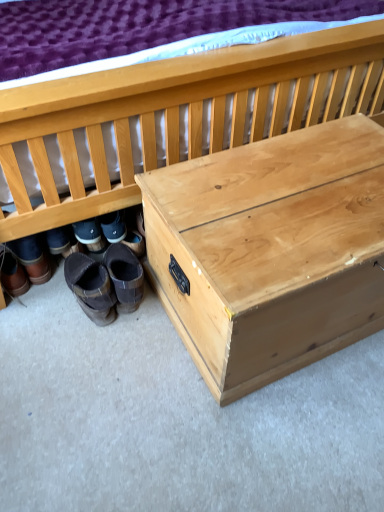
Question: Considering the positions of natural wood trunk at center and natural wood chest at lower right in the image, is natural wood trunk at center taller or shorter than natural wood chest at lower right?

Choices:
 (A) tall
 (B) short

Answer: (B)

Question: From the image's perspective, is natural wood trunk at center above or below natural wood chest at lower right?

Choices:
 (A) below
 (B) above

Answer: (A)

Question: Estimate the real-world distances between objects in this image. Which object is farther from the brown leather boots at lower left, acting as the 2th footwear starting from the left?

Choices:
 (A) brown suede boots at lower left, acting as the 4th footwear starting from the left
 (B) brown leather boots at lower left, the 4th footwear from the right
 (C) natural wood trunk at center
 (D) brown suede boots at lower left, which is counted as the third footwear, starting from the left
 (E) natural wood chest at lower right

Answer: (C)

Question: Which object is the farthest from the brown suede boots at lower left, which ranks as the second footwear in right-to-left order?

Choices:
 (A) natural wood trunk at center
 (B) brown suede boots at lower left, the first footwear from the right
 (C) natural wood chest at lower right
 (D) brown leather boots at lower left, the 4th footwear from the right
 (E) brown leather boots at lower left, which is the third footwear from right to left

Answer: (A)